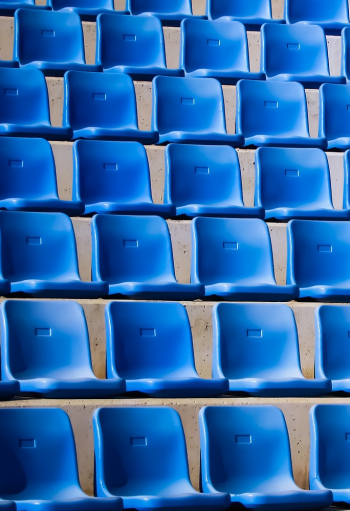
Image resolution: width=350 pixels, height=511 pixels. Identify the location of seats in the closest 2 rows to me. click(x=30, y=457), click(x=135, y=459), click(x=258, y=455), click(x=326, y=448), click(x=334, y=361), click(x=284, y=361), click(x=187, y=358), click(x=56, y=359), click(x=6, y=386).